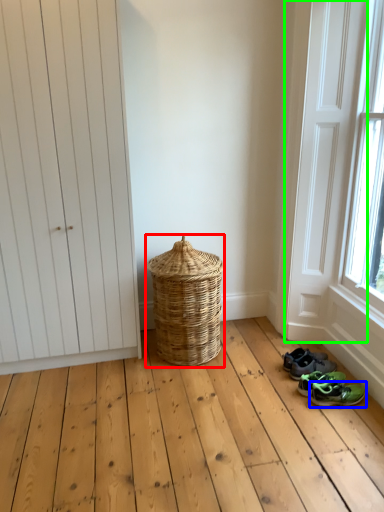
Question: Based on their relative distances, which object is farther from basket (highlighted by a red box)? Choose from footwear (highlighted by a blue box) and screen door (highlighted by a green box).

Choices:
 (A) footwear
 (B) screen door

Answer: (A)